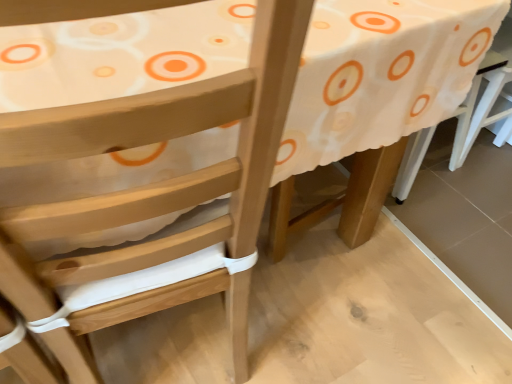
Find the location of a particular element. The height and width of the screenshot is (384, 512). white plastic chair at right is located at coordinates [471, 105].

What do you see at coordinates (471, 105) in the screenshot? This screenshot has height=384, width=512. I see `white plastic chair at right` at bounding box center [471, 105].

Measure the distance between point (x=460, y=141) and camera.

The depth of point (x=460, y=141) is 1.50 meters.

Where is `wooden table at center`? The width and height of the screenshot is (512, 384). wooden table at center is located at coordinates (381, 74).

Image resolution: width=512 pixels, height=384 pixels. Describe the element at coordinates (381, 74) in the screenshot. I see `wooden table at center` at that location.

Find the location of a particular element. white plastic chair at right is located at coordinates (471, 105).

Can you confirm if wooden table at center is positioned to the left of white plastic chair at right?

Yes, wooden table at center is to the left of white plastic chair at right.

Which object is closer to the camera taking this photo, wooden table at center or white plastic chair at right?

wooden table at center.

Considering the points (311, 99) and (486, 67), which point is in front, point (311, 99) or point (486, 67)?

The point (311, 99) is in front.

From the image's perspective, is wooden table at center positioned above or below white plastic chair at right?

From the image's perspective, wooden table at center appears below white plastic chair at right.

From a real-world perspective, is wooden table at center positioned above or below white plastic chair at right?

wooden table at center is situated higher than white plastic chair at right in the real world.

In terms of width, does wooden table at center look wider or thinner when compared to white plastic chair at right?

Considering their sizes, wooden table at center looks broader than white plastic chair at right.

Considering the relative sizes of wooden table at center and white plastic chair at right in the image provided, is wooden table at center shorter than white plastic chair at right?

In fact, wooden table at center may be taller than white plastic chair at right.

Does wooden table at center have a larger size compared to white plastic chair at right?

Yes, wooden table at center is bigger than white plastic chair at right.

Is wooden table at center spatially inside white plastic chair at right, or outside of it?

wooden table at center is outside white plastic chair at right.

Are wooden table at center and white plastic chair at right making contact?

No, wooden table at center is not touching white plastic chair at right.

Is white plastic chair at right at the back of wooden table at center?

Yes, wooden table at center is positioned with its back facing white plastic chair at right.

This screenshot has width=512, height=384. I want to click on chair behind the wooden table at center, so click(x=471, y=105).

Which object is positioned more to the left, white plastic chair at right or wooden table at center?

Positioned to the left is wooden table at center.

Between white plastic chair at right and wooden table at center, which one is positioned in front?

wooden table at center.

Is point (452, 116) positioned before point (93, 193)?

No, it is not.

From the image's perspective, between white plastic chair at right and wooden table at center, who is located below?

wooden table at center.

From a real-world perspective, is white plastic chair at right on top of wooden table at center?

No, from a real-world perspective, white plastic chair at right is not on top of wooden table at center.

Based on the photo, is white plastic chair at right wider or thinner than wooden table at center?

Clearly, white plastic chair at right has less width compared to wooden table at center.

From their relative heights in the image, would you say white plastic chair at right is taller or shorter than wooden table at center?

In the image, white plastic chair at right appears to be shorter than wooden table at center.

Does white plastic chair at right have a smaller size compared to wooden table at center?

Correct, white plastic chair at right occupies less space than wooden table at center.

Can wooden table at center be found inside white plastic chair at right?

That's incorrect, wooden table at center is not inside white plastic chair at right.

Are white plastic chair at right and wooden table at center making contact?

No, white plastic chair at right is not in contact with wooden table at center.

Could you tell me if white plastic chair at right is turned towards wooden table at center?

No, white plastic chair at right is not facing towards wooden table at center.

Can you tell me how much white plastic chair at right and wooden table at center differ in facing direction?

87.6 degrees separate the facing orientations of white plastic chair at right and wooden table at center.

This screenshot has height=384, width=512. I want to click on table on the left of the white plastic chair at right, so click(381, 74).

You are a GUI agent. You are given a task and a screenshot of the screen. Output one action in this format:
    pyautogui.click(x=<x>, y=<y>)
    Task: Click on the chair below the wooden table at center (from a real-world perspective)
    This screenshot has height=384, width=512.
    Given the screenshot: What is the action you would take?
    pyautogui.click(x=471, y=105)

What are the coordinates of `table above the white plastic chair at right (from a real-world perspective)` in the screenshot? It's located at (381, 74).